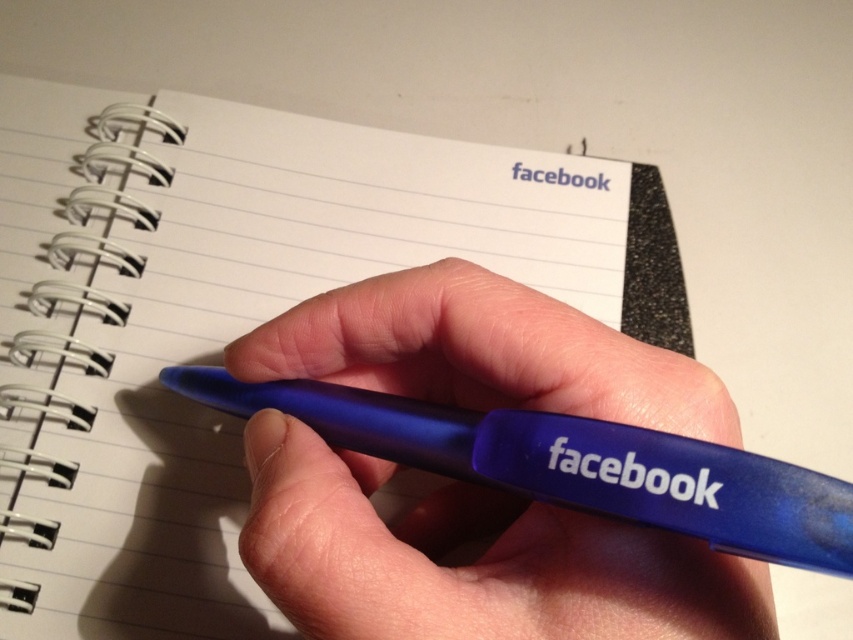
Question: Which point appears closest to the camera in this image?

Choices:
 (A) (207, 444)
 (B) (630, 604)

Answer: (B)

Question: Can you confirm if white paper notebook at center is thinner than blue rubberized pen at center?

Choices:
 (A) yes
 (B) no

Answer: (B)

Question: Does white paper notebook at center appear under blue rubberized pen at center?

Choices:
 (A) yes
 (B) no

Answer: (B)

Question: Is the position of white paper notebook at center more distant than that of blue rubberized pen at center?

Choices:
 (A) yes
 (B) no

Answer: (A)

Question: Which point is closer to the camera?

Choices:
 (A) pyautogui.click(x=506, y=355)
 (B) pyautogui.click(x=80, y=257)

Answer: (A)

Question: Among these points, which one is farthest from the camera?

Choices:
 (A) (138, 307)
 (B) (242, 536)

Answer: (A)